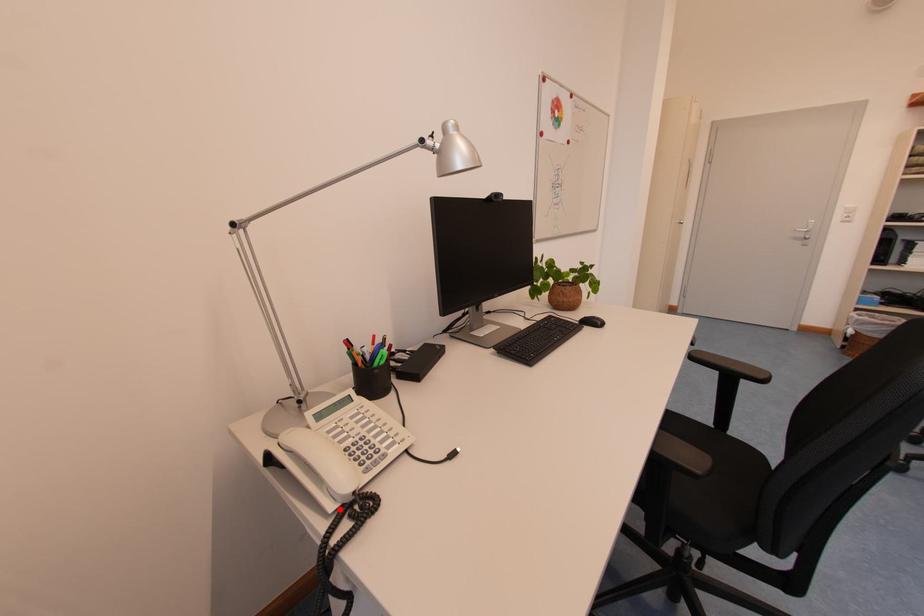
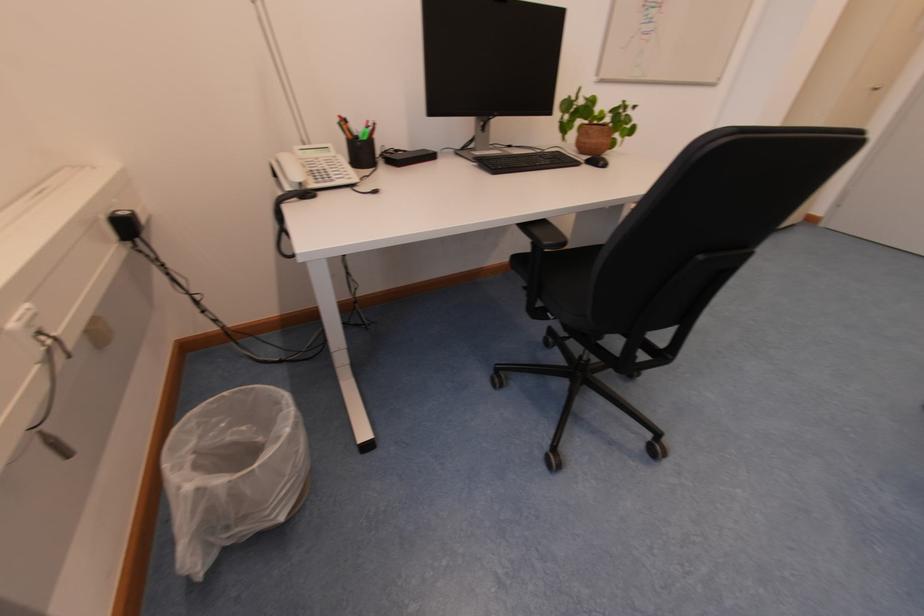
Question: I am providing you with two images of the same scene from different viewpoints. A red point is marked on the first image. Is the red point's position out of view in image 2?

Choices:
 (A) Yes
 (B) No

Answer: (B)